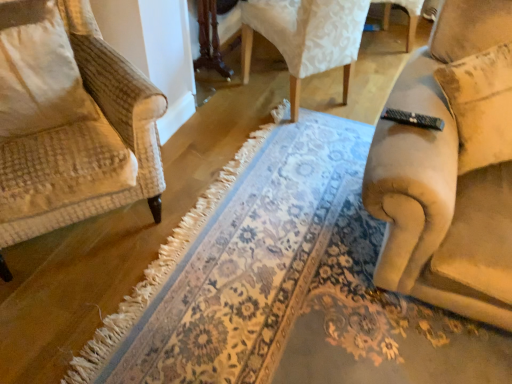
Locate an element on the screen. empty space that is ontop of floral carpet at center (from a real-world perspective) is located at coordinates [x=240, y=260].